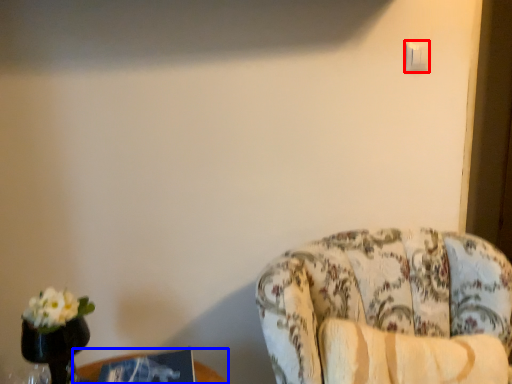
Question: Among these objects, which one is nearest to the camera, light switch (highlighted by a red box) or table (highlighted by a blue box)?

Choices:
 (A) light switch
 (B) table

Answer: (B)